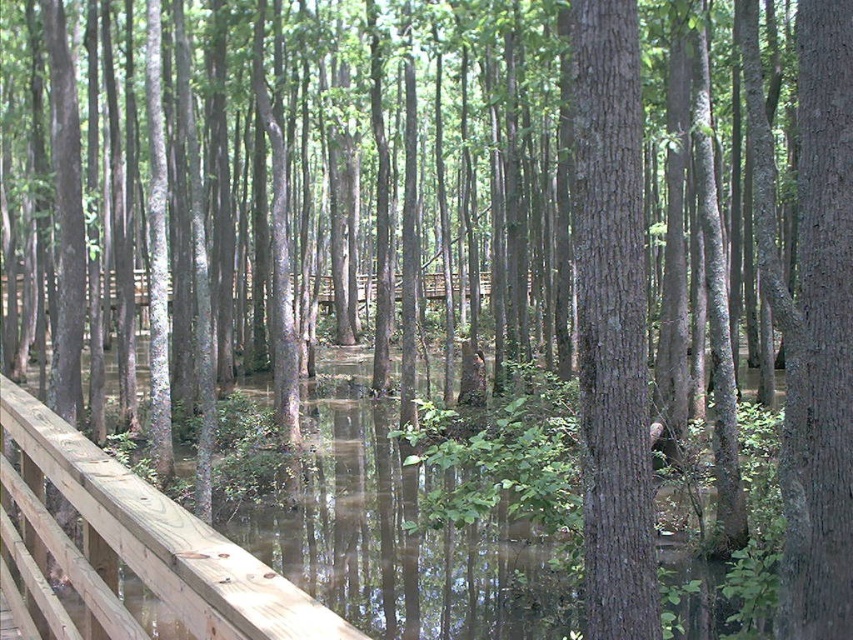
Question: Which object appears closest to the camera in this image?

Choices:
 (A) smooth brown tree trunk at center
 (B) smooth brown tree trunk at center-right
 (C) light brown wooden rail at left

Answer: (C)

Question: Which of the following is the closest to the observer?

Choices:
 (A) light brown wooden rail at left
 (B) smooth brown tree trunk at center-right
 (C) smooth brown tree trunk at center

Answer: (A)

Question: Can you confirm if smooth brown tree trunk at center is positioned to the left of smooth brown tree trunk at center-right?

Choices:
 (A) yes
 (B) no

Answer: (A)

Question: Where is smooth brown tree trunk at center located in relation to light brown wooden rail at left in the image?

Choices:
 (A) below
 (B) above

Answer: (B)

Question: Which of the following is the farthest from the observer?

Choices:
 (A) light brown wooden rail at left
 (B) smooth brown tree trunk at center
 (C) smooth brown tree trunk at center-right

Answer: (C)

Question: Does smooth brown tree trunk at center have a greater width compared to light brown wooden rail at left?

Choices:
 (A) yes
 (B) no

Answer: (B)